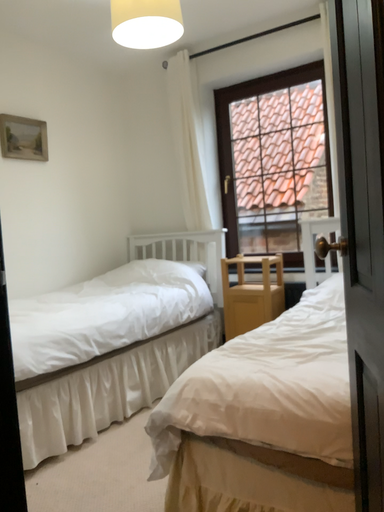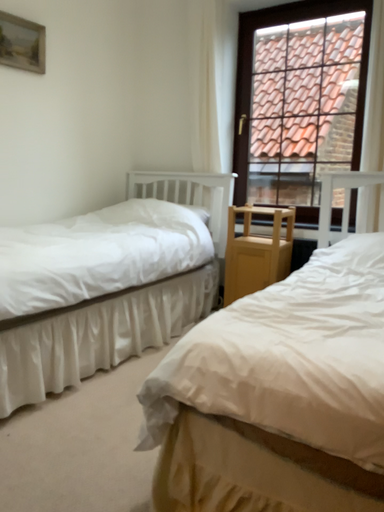
Question: Which way did the camera rotate in the video?

Choices:
 (A) rotated downward
 (B) rotated upward

Answer: (A)